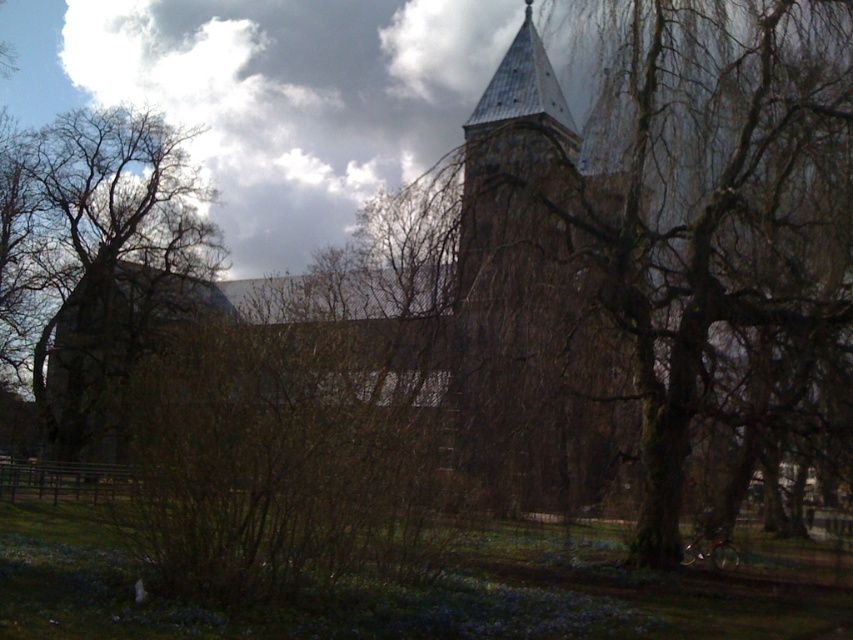
Question: Considering the relative positions of brown bark tree at center and brown textured bush at center in the image provided, where is brown bark tree at center located with respect to brown textured bush at center?

Choices:
 (A) left
 (B) right

Answer: (B)

Question: Does brown bark tree at center have a smaller size compared to brown textured bush at center?

Choices:
 (A) yes
 (B) no

Answer: (B)

Question: Can you confirm if brown textured bush at center is wider than brown rough bark tree at left?

Choices:
 (A) yes
 (B) no

Answer: (B)

Question: Among these objects, which one is nearest to the camera?

Choices:
 (A) brown rough bark tree at left
 (B) brown textured bush at center

Answer: (B)

Question: Which of the following is the farthest from the observer?

Choices:
 (A) brown bark tree at center
 (B) brown rough bark tree at left

Answer: (A)

Question: Which of the following is the farthest from the observer?

Choices:
 (A) (732, 116)
 (B) (245, 557)

Answer: (A)